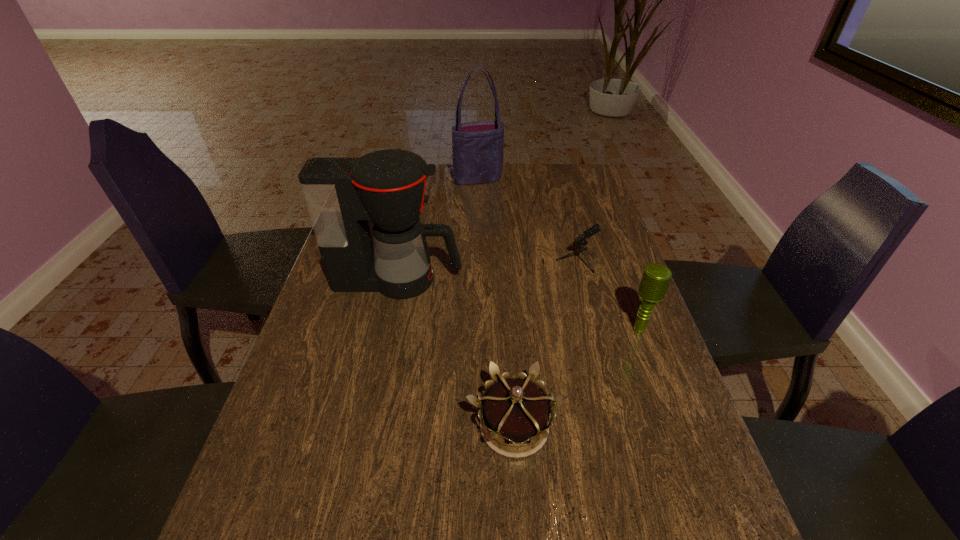
Find the location of a particular element. Image resolution: width=960 pixels, height=540 pixels. tote bag is located at coordinates (477, 147).

Where is `coffee maker`? coffee maker is located at coordinates (388, 187).

You are a GUI agent. You are given a task and a screenshot of the screen. Output one action in this format:
    pyautogui.click(x=<x>, y=<y>)
    Task: Click on the fourth farthest object
    
    Given the screenshot: What is the action you would take?
    pyautogui.click(x=656, y=277)

Identify the location of the nearer microphone. This screenshot has width=960, height=540. (656, 277).

At what (x,y) coordinates should I click in order to perform the action: click on the nearest object. Please return your answer as a coordinate pair (x, y). Image resolution: width=960 pixels, height=540 pixels. Looking at the image, I should click on pos(515,410).

You are a GUI agent. You are given a task and a screenshot of the screen. Output one action in this format:
    pyautogui.click(x=<x>, y=<y>)
    Task: Click on the left microphone
    Image resolution: width=960 pixels, height=540 pixels.
    Given the screenshot: What is the action you would take?
    pyautogui.click(x=596, y=228)

Where is `the farther microphone`? the farther microphone is located at coordinates (596, 228).

Identify the location of free space located on the right of the tote bag. The width and height of the screenshot is (960, 540). (577, 179).

Identify the location of vacant space located pour from the carafe of the coffee maker. This screenshot has height=540, width=960. (498, 280).

The image size is (960, 540). I want to click on free space located on the back of the nearer microphone, so click(x=624, y=286).